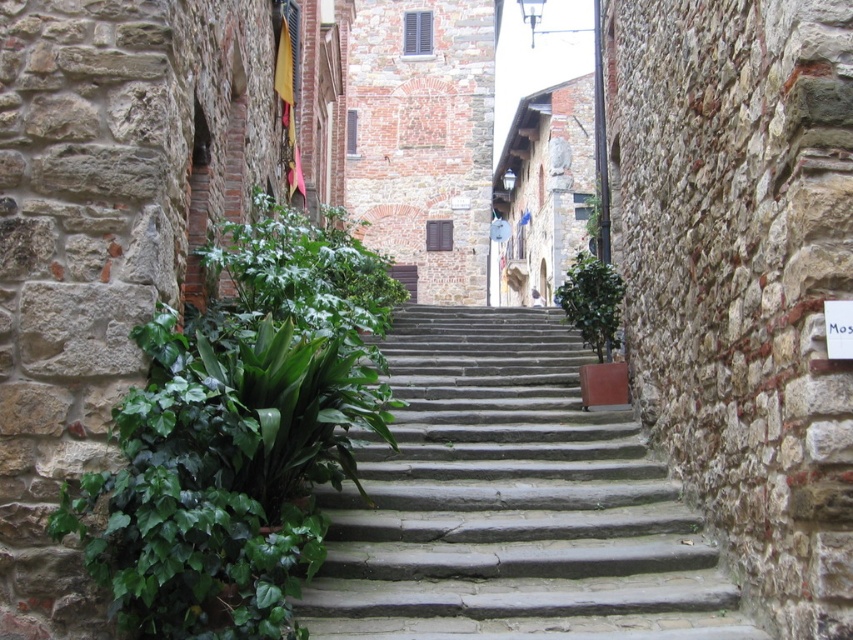
Where is `green leafy plant at left`? The width and height of the screenshot is (853, 640). green leafy plant at left is located at coordinates (239, 435).

Find the location of `green leafy plant at left`. green leafy plant at left is located at coordinates (239, 435).

Which is below, stone stairs at center or green leafy plant at left?

stone stairs at center is lower down.

Can you confirm if stone stairs at center is wider than green leafy plant at left?

Correct, the width of stone stairs at center exceeds that of green leafy plant at left.

Who is more forward, (386, 634) or (238, 500)?

Point (238, 500) is in front.

This screenshot has height=640, width=853. In order to click on stone stairs at center in this screenshot , I will do `click(509, 502)`.

Does stone stairs at center have a lesser height compared to green glossy bush at center?

Yes.

Is stone stairs at center positioned before green glossy bush at center?

Yes, stone stairs at center is closer to the viewer.

Who is more forward, (540,515) or (577,321)?

Point (540,515) is more forward.

Where is `stone stairs at center`? The image size is (853, 640). stone stairs at center is located at coordinates (509, 502).